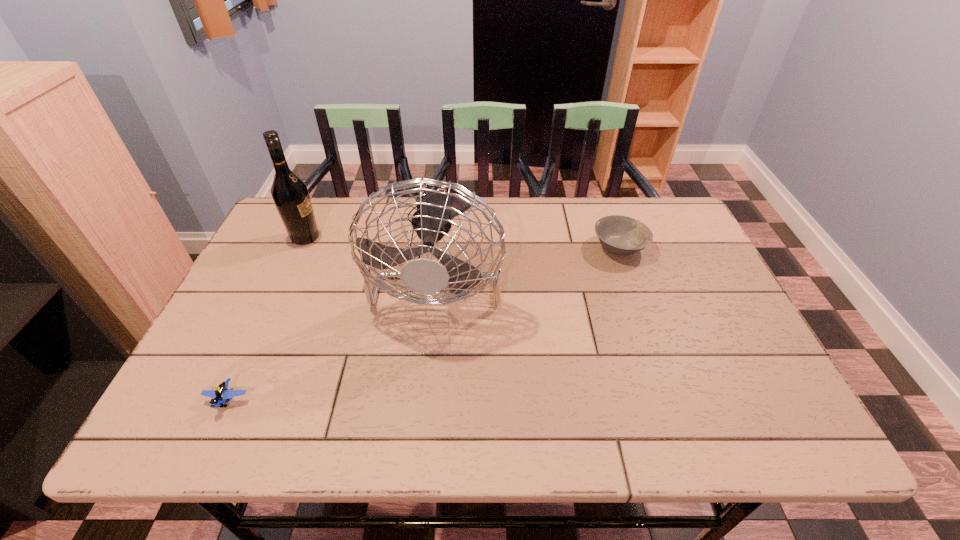
In the image, there is a desktop. Where is `vacant space at the right edge`? The image size is (960, 540). vacant space at the right edge is located at coordinates (684, 267).

The height and width of the screenshot is (540, 960). Find the location of `vacant space at the far right corner of the desktop`. vacant space at the far right corner of the desktop is located at coordinates (643, 206).

The height and width of the screenshot is (540, 960). Find the location of `unoccupied position between the nearest object and the fan`. unoccupied position between the nearest object and the fan is located at coordinates (333, 335).

In order to click on free space that is in between the nearest object and the second object from right to left in this screenshot , I will do `click(333, 335)`.

Find the location of a particular element. The image size is (960, 540). free space between the fan and the bowl is located at coordinates (529, 259).

You are a GUI agent. You are given a task and a screenshot of the screen. Output one action in this format:
    pyautogui.click(x=<x>, y=<y>)
    Task: Click on the vacant area between the rightmost object and the third object from left to right
    The height and width of the screenshot is (540, 960).
    Given the screenshot: What is the action you would take?
    pyautogui.click(x=529, y=259)

This screenshot has width=960, height=540. Find the location of `vacant space in between the fan and the Lego`. vacant space in between the fan and the Lego is located at coordinates [x=333, y=335].

Locate an element on the screen. This screenshot has height=540, width=960. vacant point located between the bowl and the fan is located at coordinates (529, 259).

Where is `vacant area that lies between the rightmost object and the third object from left to right`? The height and width of the screenshot is (540, 960). vacant area that lies between the rightmost object and the third object from left to right is located at coordinates (529, 259).

Locate an element on the screen. empty space between the Lego and the wine bottle is located at coordinates (267, 319).